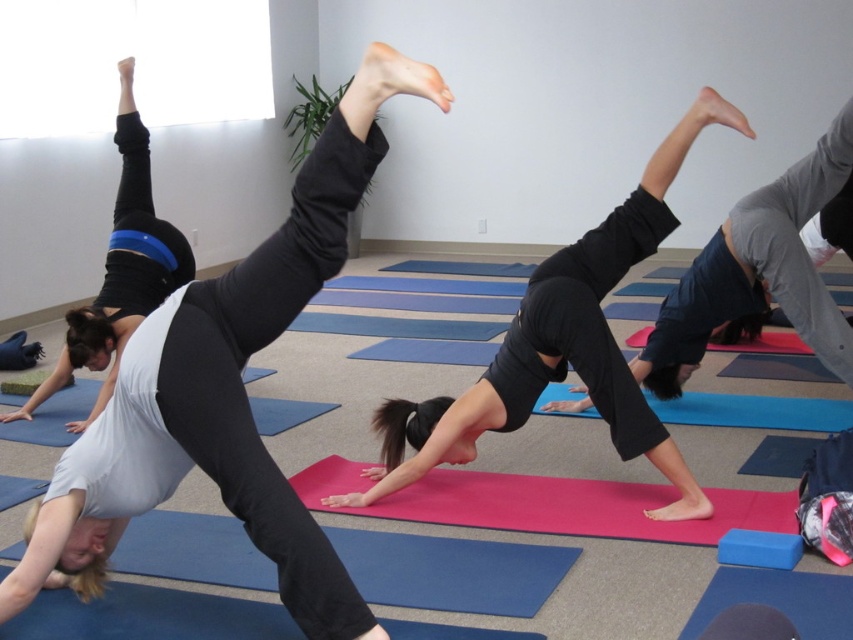
What do you see at coordinates (224, 390) in the screenshot? This screenshot has height=640, width=853. I see `matte black leggings at upper center` at bounding box center [224, 390].

Who is lower down, matte black leggings at upper center or pink rubber yoga mat at center?

pink rubber yoga mat at center

Is point (201, 426) farther from viewer compared to point (349, 481)?

No, (201, 426) is in front of (349, 481).

Find the location of a particular element. matte black leggings at upper center is located at coordinates (224, 390).

Between point (619, 406) and point (115, 118), which one is positioned behind?

The point (115, 118) is behind.

Between point (606, 234) and point (132, 76), which one is positioned behind?

Point (132, 76)

The height and width of the screenshot is (640, 853). I want to click on black matte yoga pants at center, so click(561, 346).

Looking at this image, is pink rubber yoga mat at center closer to camera compared to matte black leggings at center?

Yes, pink rubber yoga mat at center is closer to the viewer.

Is point (599, 504) farther from camera compared to point (38, 390)?

No, it is in front of (38, 390).

Locate an element on the screen. This screenshot has height=640, width=853. pink rubber yoga mat at center is located at coordinates (548, 502).